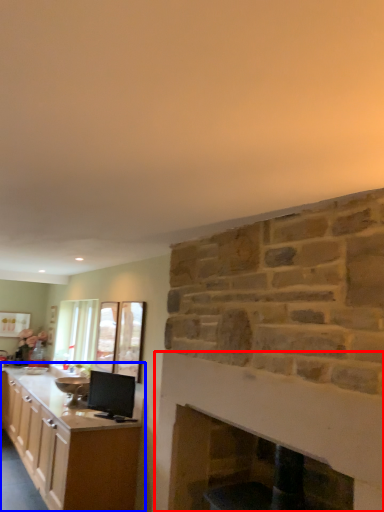
Question: Among these objects, which one is farthest to the camera, fireplace (highlighted by a red box) or cabinetry (highlighted by a blue box)?

Choices:
 (A) fireplace
 (B) cabinetry

Answer: (B)